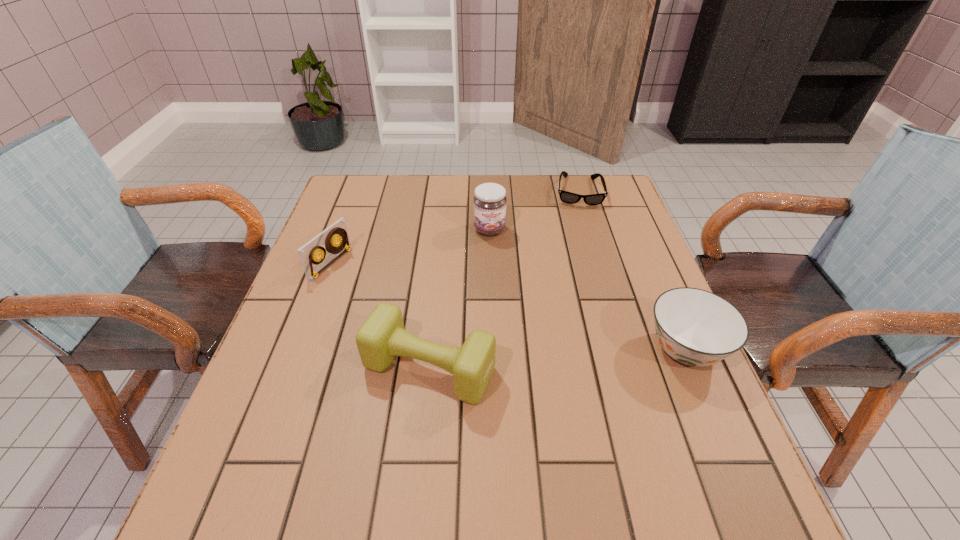
At what (x,y) coordinates should I click in order to perform the action: click on free space that is in between the videotape and the sunglasses. Please return your answer as a coordinate pair (x, y). Looking at the image, I should click on (454, 227).

This screenshot has height=540, width=960. Find the location of `unoccupied area between the dumbbell and the second farthest object`. unoccupied area between the dumbbell and the second farthest object is located at coordinates (460, 299).

Locate an element on the screen. The image size is (960, 540). empty space between the jam and the dumbbell is located at coordinates click(x=460, y=299).

Where is `free point between the soup bowl and the videotape`? The width and height of the screenshot is (960, 540). free point between the soup bowl and the videotape is located at coordinates (508, 306).

Find the location of a particular element. The width and height of the screenshot is (960, 540). free spot between the jam and the soup bowl is located at coordinates point(588,289).

I want to click on unoccupied area between the soup bowl and the jam, so click(588, 289).

Locate an element on the screen. free point between the fourth nearest object and the soup bowl is located at coordinates (588, 289).

I want to click on free space between the leftmost object and the shortest object, so click(x=454, y=227).

Locate an element on the screen. This screenshot has height=540, width=960. free space between the leftmost object and the shortest object is located at coordinates (454, 227).

Identify the location of blank region between the shortest object and the jam. This screenshot has width=960, height=540. (534, 210).